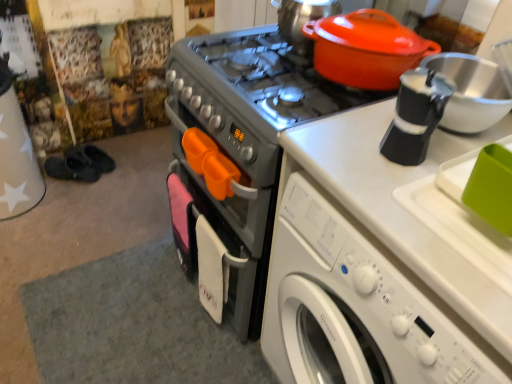
Locate an element on the screen. Image resolution: width=512 pixels, height=384 pixels. free space that is to the left of matte orange pot at upper right is located at coordinates (280, 76).